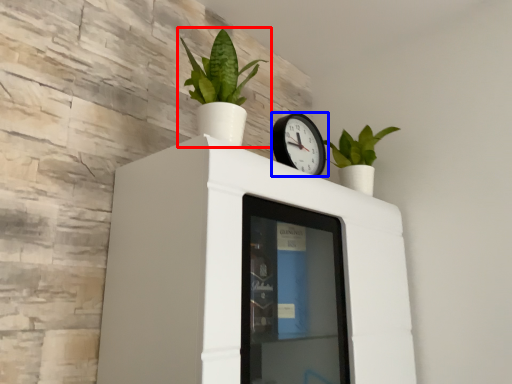
Question: Which point is further to the camera, houseplant (highlighted by a red box) or wall clock (highlighted by a blue box)?

Choices:
 (A) houseplant
 (B) wall clock

Answer: (B)